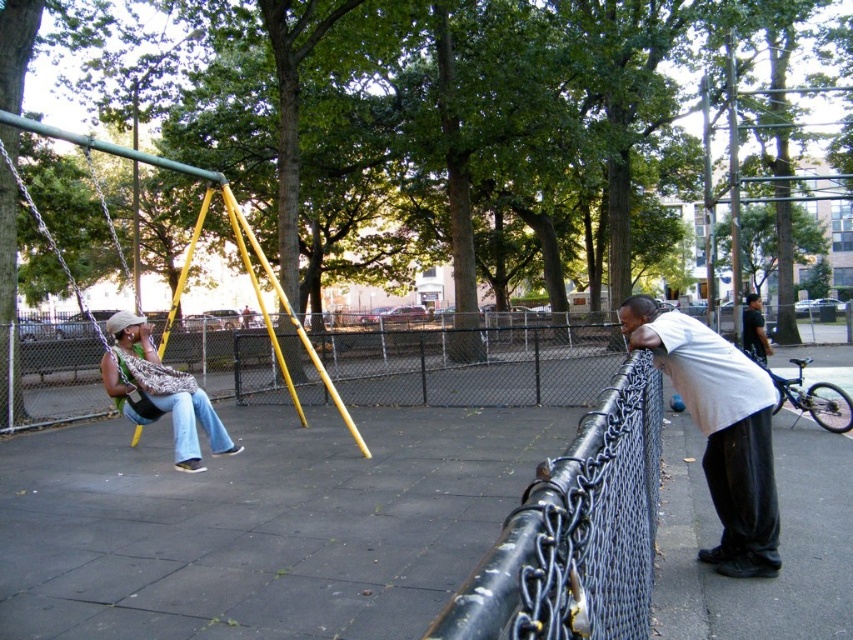
You are standing at the center of the playground and want to ride the black matte bicycle at right. Which direction should you walk to reach it?

The black matte bicycle at right is located at the right side of the playground, so you should walk towards the right to reach it.

You are at the playground and see the black matte bicycle at right and the dark green shirt at right. Which object is narrower?

The black matte bicycle at right is thinner than the dark green shirt at right.